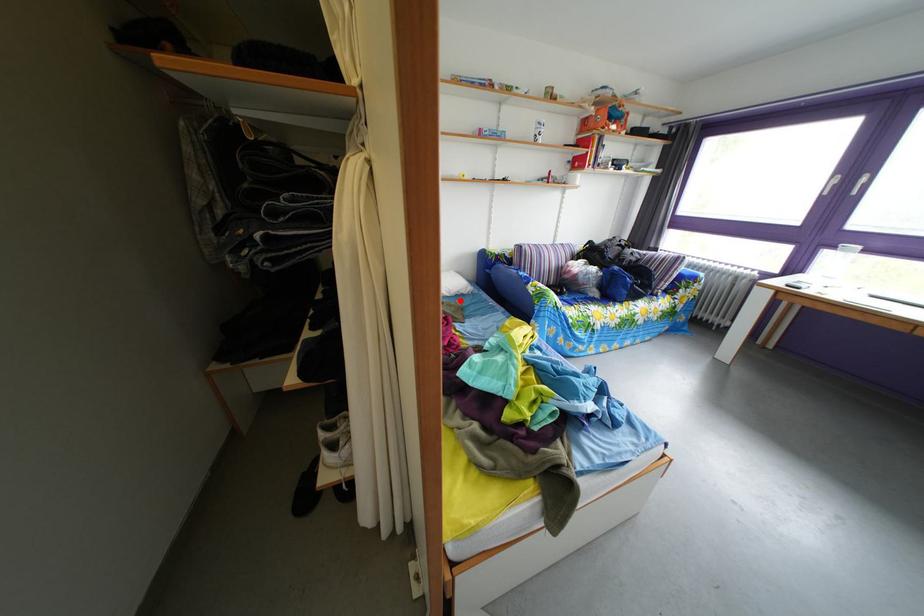
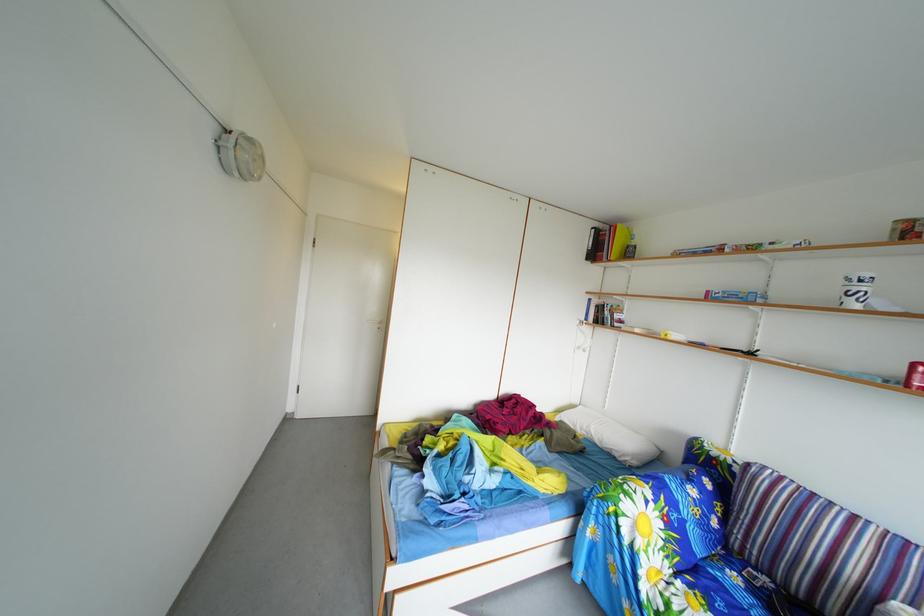
Find the pixel in the second image that matches the highlighted location in the first image.

(612, 451)